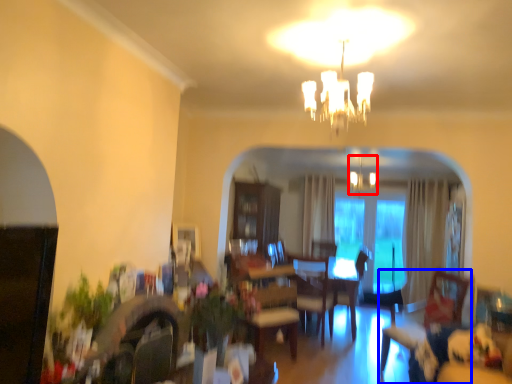
Question: Among these objects, which one is nearest to the camera, fixture (highlighted by a red box) or swivel chair (highlighted by a blue box)?

Choices:
 (A) fixture
 (B) swivel chair

Answer: (B)